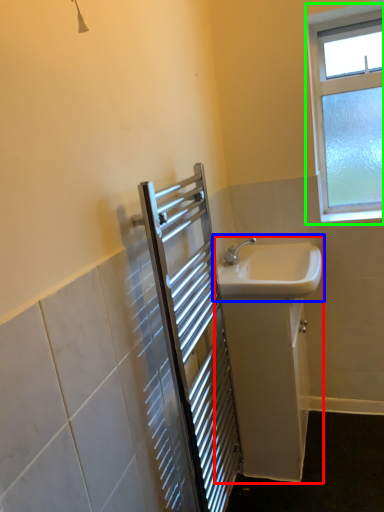
Question: Considering the real-world distances, which object is farthest from sink (highlighted by a red box)? sink (highlighted by a blue box) or window (highlighted by a green box)?

Choices:
 (A) sink
 (B) window

Answer: (B)